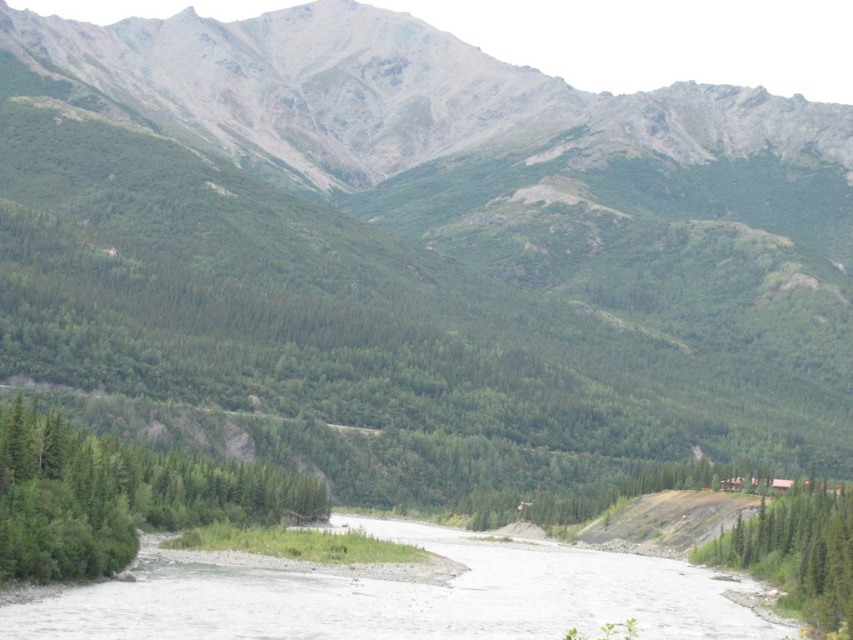
Does green matte tree at lower left have a lesser width compared to green textured tree at lower right?

Incorrect, green matte tree at lower left's width is not less than green textured tree at lower right's.

Does green matte tree at lower left have a greater width compared to green textured tree at lower right?

Indeed, green matte tree at lower left has a greater width compared to green textured tree at lower right.

Who is more forward, (244, 476) or (830, 586)?

Positioned in front is point (830, 586).

Locate an element on the screen. green matte tree at lower left is located at coordinates (119, 496).

Where is `white gravel river at lower center`? white gravel river at lower center is located at coordinates (401, 596).

Who is more distant from viewer, [491,557] or [41,419]?

The point [491,557] is more distant.

Locate an element on the screen. This screenshot has height=640, width=853. white gravel river at lower center is located at coordinates (401, 596).

Can you confirm if white gravel river at lower center is bigger than green textured tree at lower right?

Yes, white gravel river at lower center is bigger than green textured tree at lower right.

Who is more forward, (169, 552) or (787, 600)?

Point (787, 600) is more forward.

In the scene shown: Who is more distant from viewer, [416,608] or [833,586]?

Positioned behind is point [833,586].

You are a GUI agent. You are given a task and a screenshot of the screen. Output one action in this format:
    pyautogui.click(x=<x>, y=<y>)
    Task: Click on the white gravel river at lower center
    This screenshot has width=853, height=640.
    Given the screenshot: What is the action you would take?
    pyautogui.click(x=401, y=596)